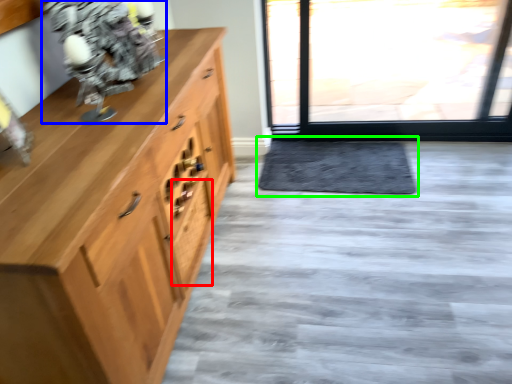
Question: Based on their relative distances, which object is nearer to drawer (highlighted by a red box)? Choose from figurine (highlighted by a blue box) and doormat (highlighted by a green box).

Choices:
 (A) figurine
 (B) doormat

Answer: (A)